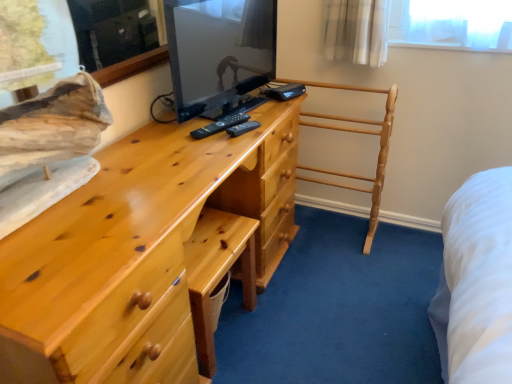
Question: Relative to matte black tv at center, is matte pine chest of drawers at center in front or behind?

Choices:
 (A) behind
 (B) front

Answer: (B)

Question: Considering the positions of matte pine chest of drawers at center and matte black tv at center in the image, is matte pine chest of drawers at center wider or thinner than matte black tv at center?

Choices:
 (A) wide
 (B) thin

Answer: (A)

Question: Estimate the real-world distances between objects in this image. Which object is farther from the black plastic remote at center?

Choices:
 (A) matte pine chest of drawers at center
 (B) light brown wooden towel rack at center
 (C) matte black tv at center

Answer: (B)

Question: Estimate the real-world distances between objects in this image. Which object is farther from the matte black tv at center?

Choices:
 (A) matte pine chest of drawers at center
 (B) light brown wooden towel rack at center
 (C) black plastic remote at center

Answer: (B)